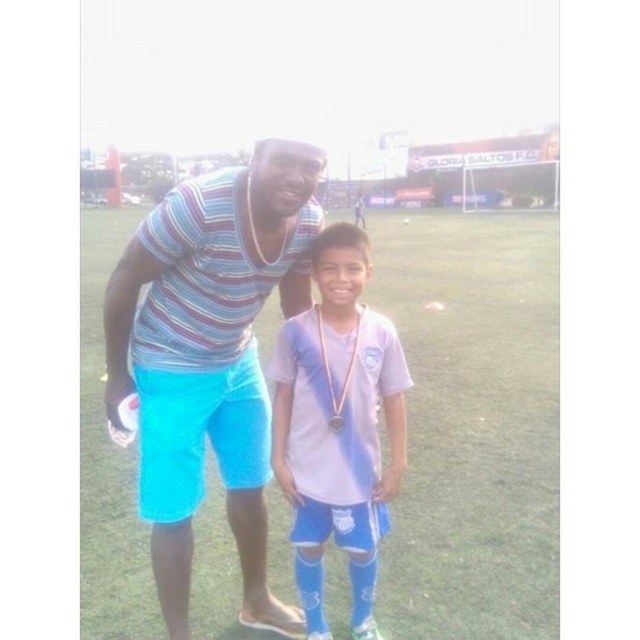
Question: Which of the following is the farthest from the observer?

Choices:
 (A) gold metallic medal at center
 (B) striped cotton shirt at center

Answer: (A)

Question: Among these objects, which one is farthest from the camera?

Choices:
 (A) gold metallic medal at center
 (B) green grass at center
 (C) white jersey at center
 (D) striped cotton shirt at center

Answer: (B)

Question: Observing the image, what is the correct spatial positioning of white jersey at center in reference to gold metallic medal at center?

Choices:
 (A) right
 (B) left

Answer: (B)

Question: Does green grass at center appear under gold metallic medal at center?

Choices:
 (A) no
 (B) yes

Answer: (A)

Question: Can you confirm if striped cotton shirt at center is wider than white jersey at center?

Choices:
 (A) yes
 (B) no

Answer: (A)

Question: Which point is farther to the camera?

Choices:
 (A) (356, 432)
 (B) (339, 420)
 (C) (428, 481)

Answer: (C)